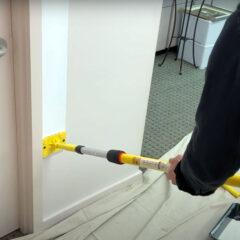
Identify the location of chair legs. Image resolution: width=240 pixels, height=240 pixels. (162, 62), (181, 66), (175, 57), (193, 62).